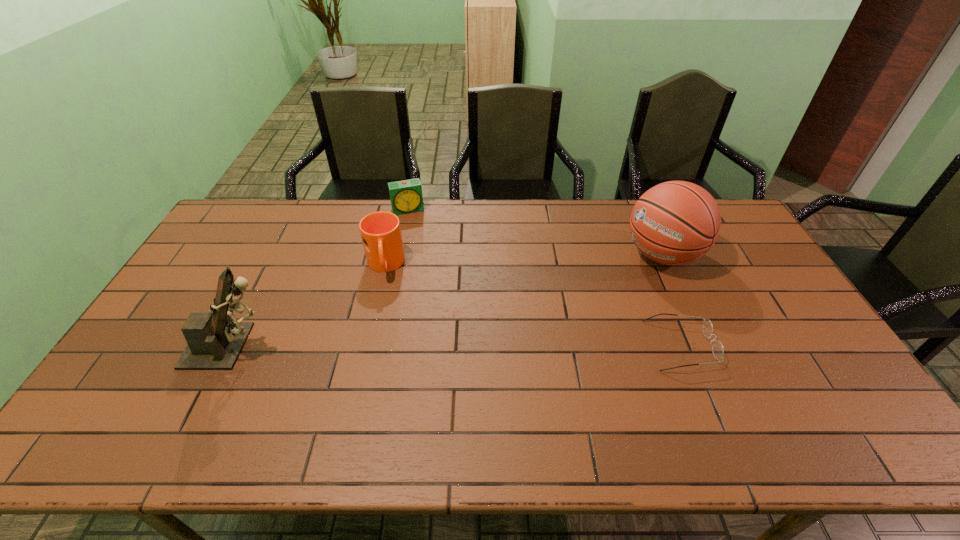
The width and height of the screenshot is (960, 540). I want to click on vacant space situated on the handle side of the mug, so click(395, 374).

Image resolution: width=960 pixels, height=540 pixels. Identify the location of vacant space located 0.080m on the logo side of the basketball. point(621,281).

Locate an element on the screen. free space located 0.070m on the logo side of the basketball is located at coordinates (623, 280).

Image resolution: width=960 pixels, height=540 pixels. What are the coordinates of `free location located on the logo side of the basketball` in the screenshot? It's located at (595, 298).

Locate an element on the screen. free space located on the front-facing side of the alarm clock is located at coordinates (416, 228).

At what (x,y) coordinates should I click in order to perform the action: click on free point located 0.090m on the front-facing side of the alarm clock. Please return your answer as a coordinate pair (x, y). Looking at the image, I should click on (416, 230).

Find the location of a particular element. free space located 0.100m on the front-facing side of the alarm clock is located at coordinates (417, 232).

Find the location of a particular element. basketball that is at the far edge is located at coordinates (676, 222).

Find the location of a particular element. The width and height of the screenshot is (960, 540). alarm clock at the far edge is located at coordinates (406, 197).

Where is `object positioned at the left edge`? object positioned at the left edge is located at coordinates (215, 342).